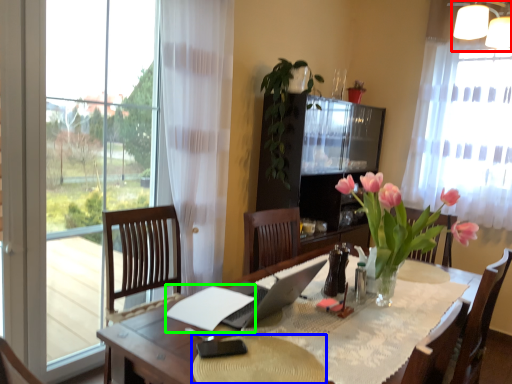
Question: Which object is the closest to the lamp (highlighted by a red box)? Choose among these: flat (highlighted by a blue box) or notepad (highlighted by a green box).

Choices:
 (A) flat
 (B) notepad

Answer: (B)